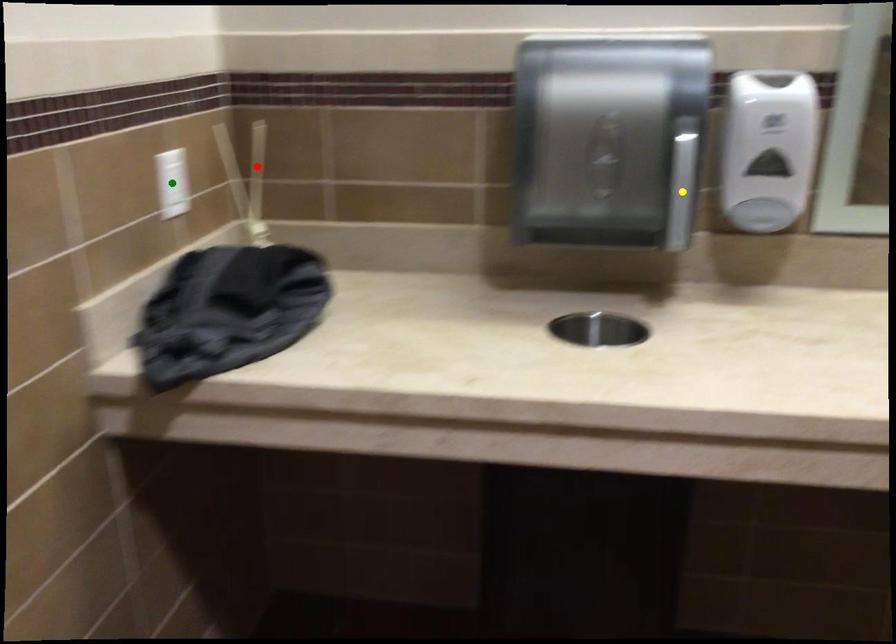
Order these from nearest to farthest:
A) red point
B) green point
C) yellow point

yellow point → green point → red point